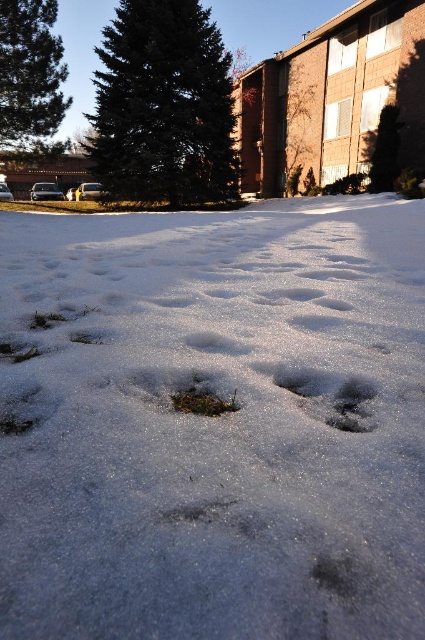
Question: Is green matte pine at upper left to the right of white fluffy footprint at center from the viewer's perspective?

Choices:
 (A) yes
 (B) no

Answer: (B)

Question: Which point is farther to the camera?

Choices:
 (A) (419, 234)
 (B) (93, 172)
 (C) (331, 300)
 (D) (234, 408)

Answer: (B)

Question: Which object appears farthest from the camera in this image?

Choices:
 (A) green matte pine at upper left
 (B) green grass at center

Answer: (A)

Question: Does white fluffy snow at center appear over green grass at center?

Choices:
 (A) no
 (B) yes

Answer: (B)

Question: In this image, where is green needle-like pine at upper left located relative to green grass at center?

Choices:
 (A) above
 (B) below

Answer: (A)

Question: Among these objects, which one is farthest from the camera?

Choices:
 (A) green grass at center
 (B) green needle-like pine at upper left
 (C) white fluffy snow at center
 (D) green matte pine at upper left

Answer: (B)